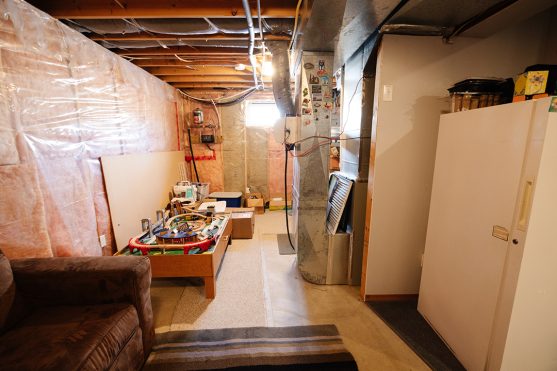
Find the location of a particular element. Image resolution: width=557 pixels, height=371 pixels. stickers is located at coordinates (316, 88), (316, 95), (307, 64), (317, 63).